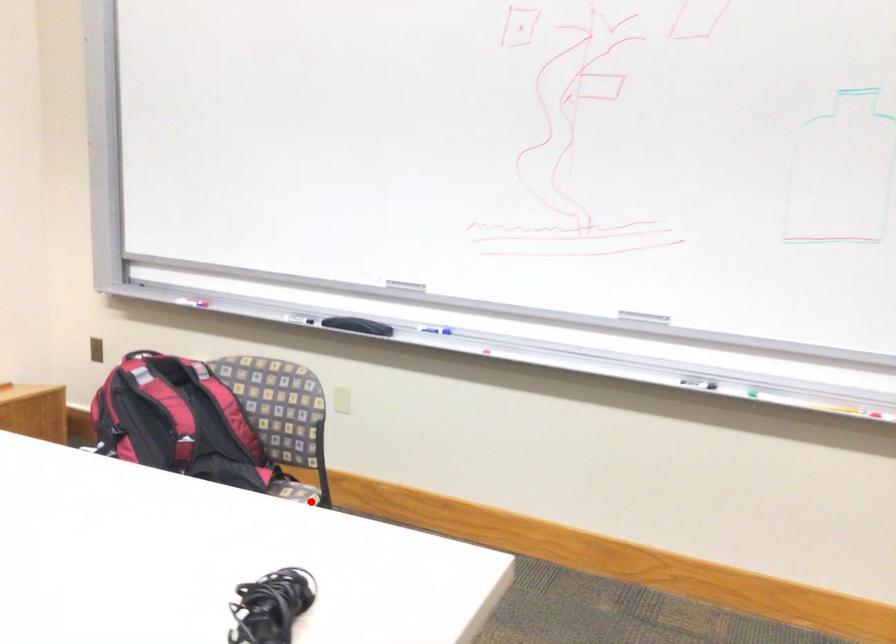
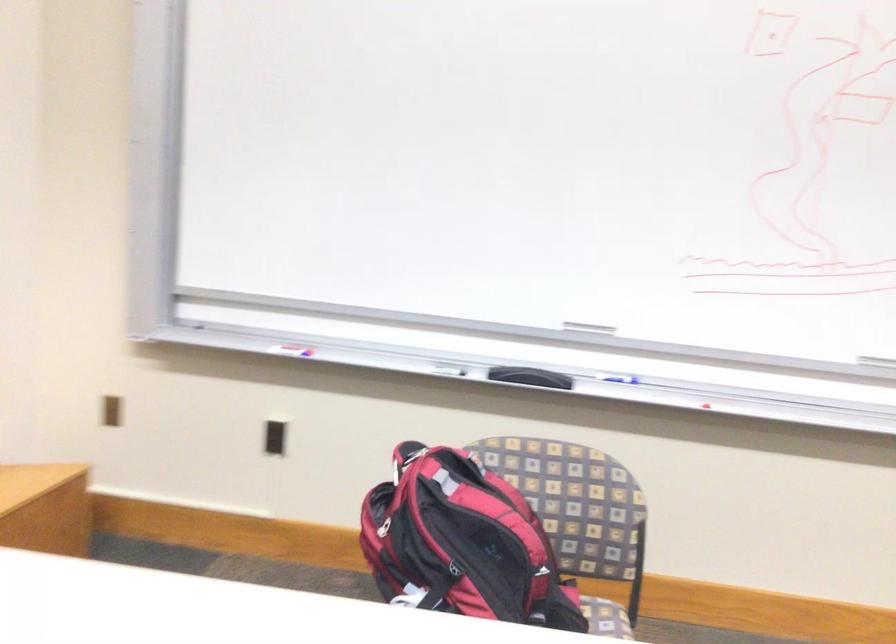
The point at the highlighted location is marked in the first image. Where is the corresponding point in the second image?

(606, 618)